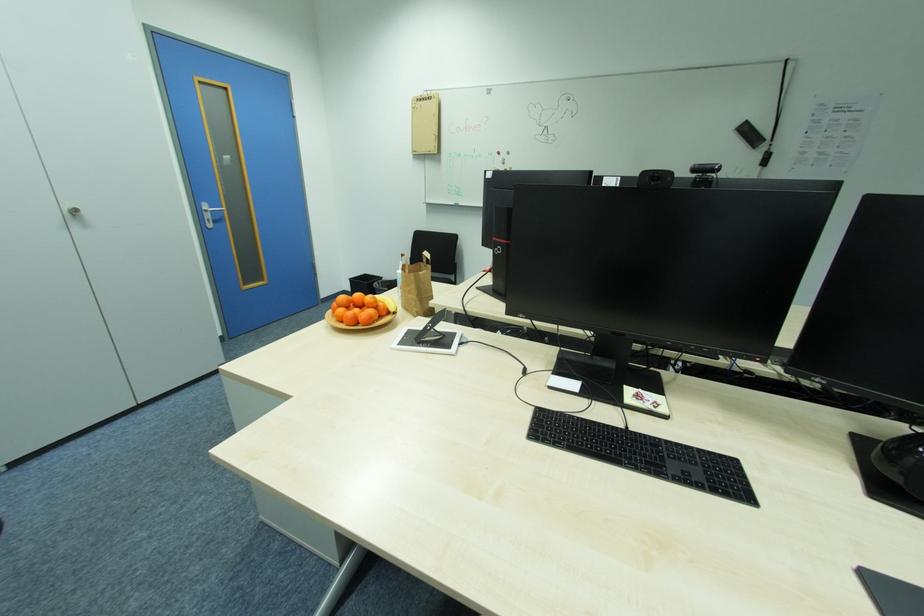
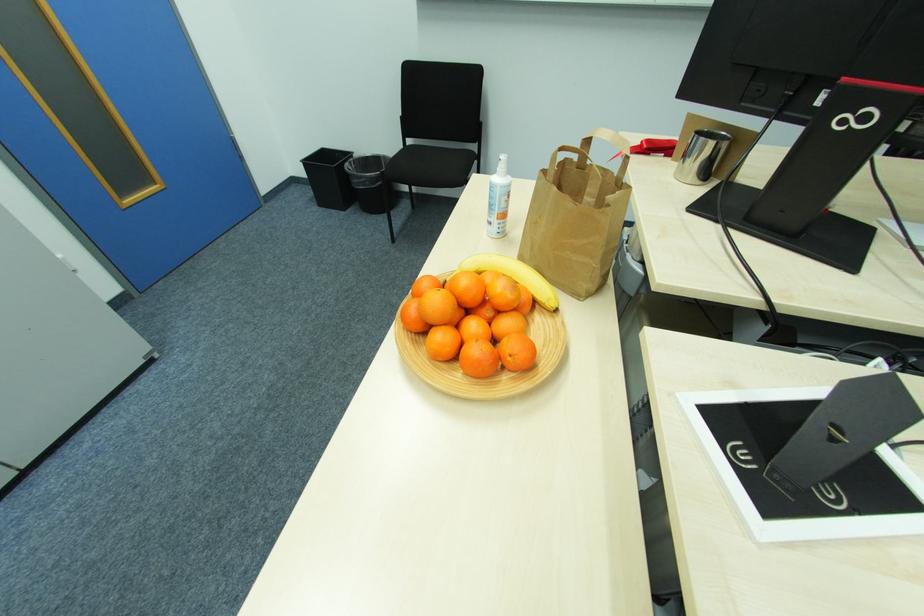
Which direction would the cameraman need to move to produce the second image?

The movement direction of the cameraman is left, forward.